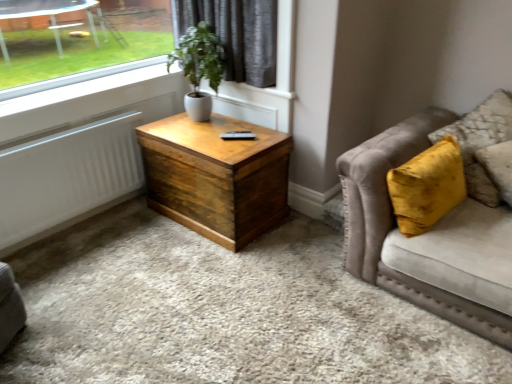
Question: Is there a large distance between wooden chest at center and white ceramic pot at upper center?

Choices:
 (A) yes
 (B) no

Answer: (B)

Question: Is wooden chest at center closer to the viewer compared to white ceramic pot at upper center?

Choices:
 (A) no
 (B) yes

Answer: (B)

Question: Could white ceramic pot at upper center be considered to be inside wooden chest at center?

Choices:
 (A) no
 (B) yes

Answer: (A)

Question: Is wooden chest at center smaller than white ceramic pot at upper center?

Choices:
 (A) yes
 (B) no

Answer: (B)

Question: Considering the relative sizes of wooden chest at center and white ceramic pot at upper center in the image provided, is wooden chest at center thinner than white ceramic pot at upper center?

Choices:
 (A) no
 (B) yes

Answer: (A)

Question: Does point (12, 170) appear closer or farther from the camera than point (480, 130)?

Choices:
 (A) farther
 (B) closer

Answer: (B)

Question: In the image, is white matte radiator at left on the left side or the right side of velvet yellow pillow at right?

Choices:
 (A) left
 (B) right

Answer: (A)

Question: Based on their sizes in the image, would you say white matte radiator at left is bigger or smaller than velvet yellow pillow at right?

Choices:
 (A) small
 (B) big

Answer: (A)

Question: In the image, is white matte radiator at left positioned in front of or behind velvet yellow pillow at right?

Choices:
 (A) front
 (B) behind

Answer: (B)

Question: Based on their positions, is white ceramic pot at upper center located to the left or right of velvet beige couch at right?

Choices:
 (A) left
 (B) right

Answer: (A)

Question: Relative to velvet beige couch at right, is white ceramic pot at upper center in front or behind?

Choices:
 (A) front
 (B) behind

Answer: (B)

Question: Choose the correct answer: Is white ceramic pot at upper center inside velvet beige couch at right or outside it?

Choices:
 (A) inside
 (B) outside

Answer: (B)

Question: Considering the positions of white ceramic pot at upper center and velvet beige couch at right in the image, is white ceramic pot at upper center wider or thinner than velvet beige couch at right?

Choices:
 (A) thin
 (B) wide

Answer: (A)

Question: Would you say wooden chest at center is to the left or to the right of velvet beige couch at right in the picture?

Choices:
 (A) right
 (B) left

Answer: (B)

Question: Relative to velvet beige couch at right, is wooden chest at center in front or behind?

Choices:
 (A) front
 (B) behind

Answer: (B)